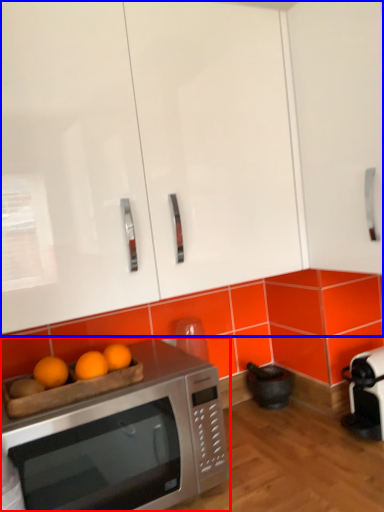
Question: Which point is further to the camera, microwave oven (highlighted by a red box) or cabinetry (highlighted by a blue box)?

Choices:
 (A) microwave oven
 (B) cabinetry

Answer: (A)